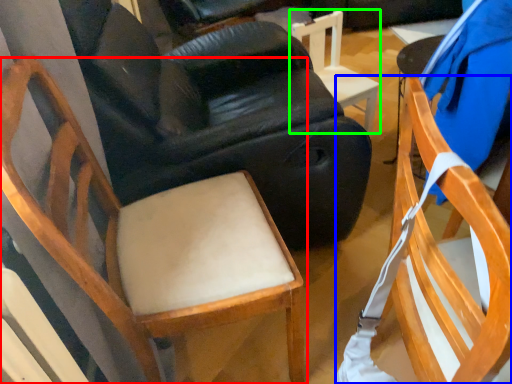
Question: Which is farther away from chair (highlighted by a red box)? chair (highlighted by a blue box) or chair (highlighted by a green box)?

Choices:
 (A) chair
 (B) chair

Answer: (B)